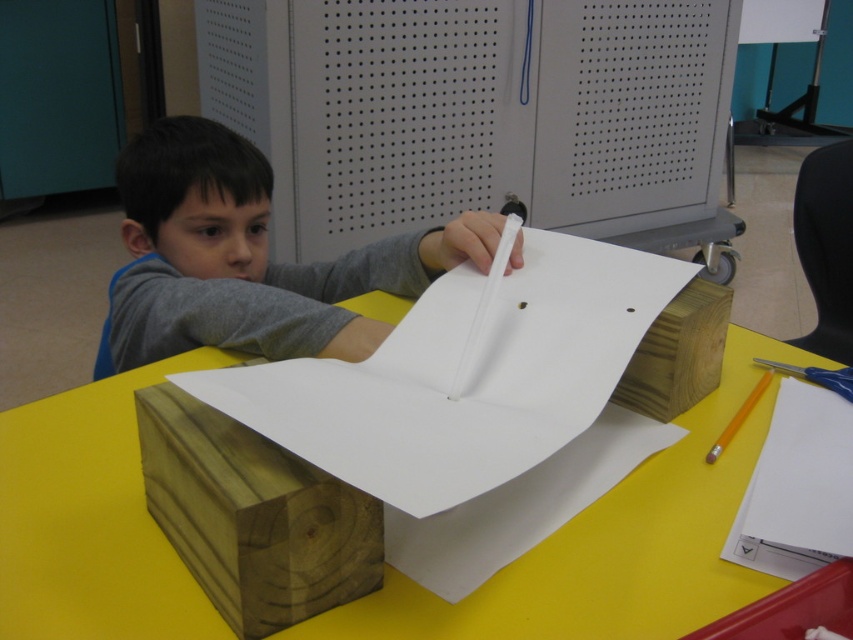
Question: Estimate the real-world distances between objects in this image. Which object is closer to the gray perforated locker at upper center?

Choices:
 (A) yellow matte pencil at center
 (B) yellow matte table at center
 (C) gray matte shirt at upper left

Answer: (C)

Question: Which point appears closest to the camera in this image?

Choices:
 (A) (247, 404)
 (B) (734, 432)

Answer: (A)

Question: Can you confirm if yellow matte table at center is positioned to the left of yellow matte pencil at center?

Choices:
 (A) yes
 (B) no

Answer: (A)

Question: Is yellow matte table at center positioned at the back of white paper at center?

Choices:
 (A) yes
 (B) no

Answer: (A)

Question: Is gray perforated locker at upper center above yellow matte table at center?

Choices:
 (A) no
 (B) yes

Answer: (B)

Question: Which point is closer to the camera?

Choices:
 (A) white paper at center
 (B) yellow matte pencil at center

Answer: (A)